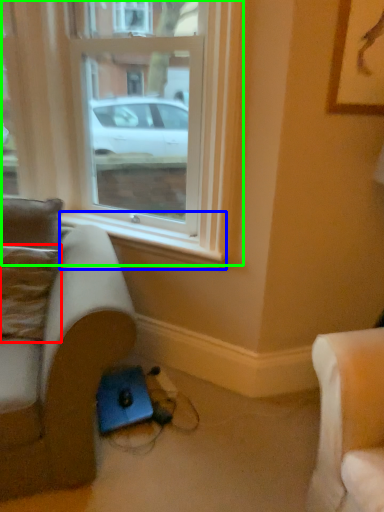
Question: Considering the real-world distances, which object is farthest from pillow (highlighted by a red box)? window sill (highlighted by a blue box) or window (highlighted by a green box)?

Choices:
 (A) window sill
 (B) window

Answer: (B)